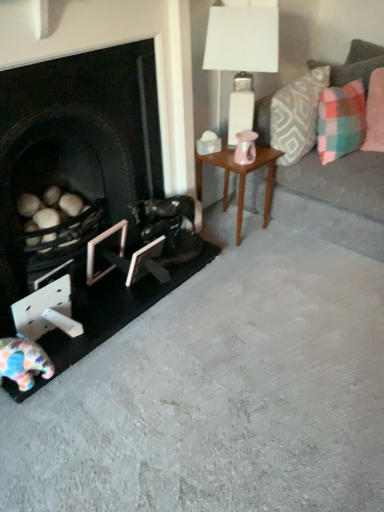
Question: Considering the positions of white glossy table lamp at upper right and white matte picture frame at lower center, which is counted as the 1th picture frame, starting from the right, in the image, is white glossy table lamp at upper right bigger or smaller than white matte picture frame at lower center, which is counted as the 1th picture frame, starting from the right,?

Choices:
 (A) big
 (B) small

Answer: (A)

Question: Is white glossy table lamp at upper right taller or shorter than white matte picture frame at lower center, the 2th picture frame viewed from the left?

Choices:
 (A) short
 (B) tall

Answer: (B)

Question: Estimate the real-world distances between objects in this image. Which object is farther from the wooden side table at center?

Choices:
 (A) fluffy fabric toy at lower left
 (B) black matte fireplace at left
 (C) plaid fabric pillow at upper right, which is the 3th pillow from right to left
 (D) pink fabric pillow at upper right, which is the 3th pillow from left to right
 (E) white glossy table lamp at upper right

Answer: (A)

Question: Which object is positioned farthest from the white matte picture frame at lower center, the 2th picture frame viewed from the left?

Choices:
 (A) metallic silver picture frame at lower left, arranged as the second picture frame when viewed from the right
 (B) white glossy table lamp at upper right
 (C) wooden side table at center
 (D) shiny black leather swivel chair at center
 (E) black matte fireplace at left

Answer: (B)